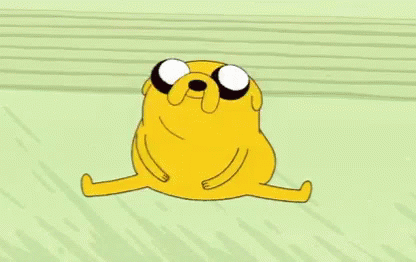
The width and height of the screenshot is (416, 262). What are the coordinates of `dark spots in floor` in the screenshot? It's located at (318, 221), (170, 239), (109, 245), (53, 169), (34, 136), (221, 240).